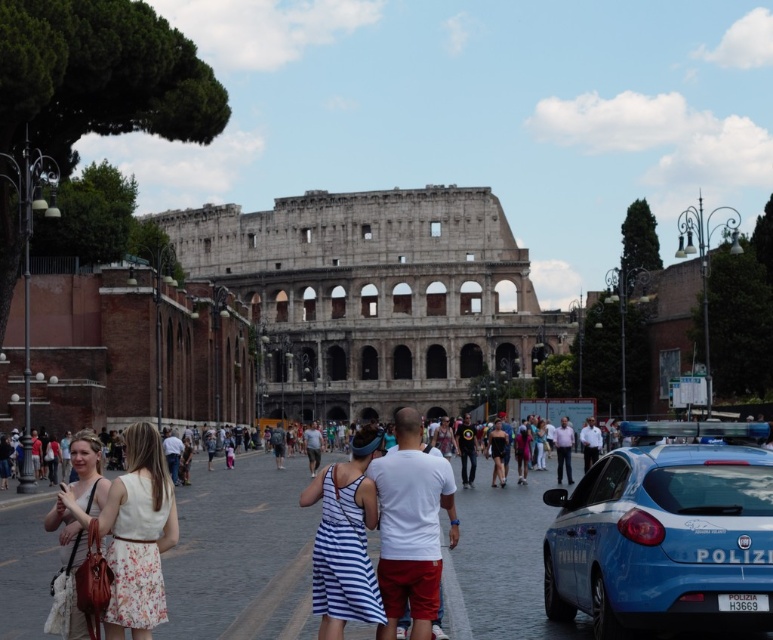
Is point (368, 426) positioned after point (89, 461)?

Yes, point (368, 426) is behind point (89, 461).

Which is more to the right, white striped dress at center or floral dress at lower left?

From the viewer's perspective, white striped dress at center appears more on the right side.

You are a GUI agent. You are given a task and a screenshot of the screen. Output one action in this format:
    pyautogui.click(x=<x>, y=<y>)
    Task: Click on the white striped dress at center
    The width and height of the screenshot is (773, 640).
    Given the screenshot: What is the action you would take?
    pyautogui.click(x=344, y=540)

At what (x,y) coordinates should I click in order to perform the action: click on white striped dress at center. Please return your answer as a coordinate pair (x, y). The height and width of the screenshot is (640, 773). Looking at the image, I should click on (344, 540).

Identify the location of white floral dress at lower left. (138, 536).

Is white floral dress at lower left further to camera compared to white cotton shirt at center?

No, white floral dress at lower left is in front of white cotton shirt at center.

I want to click on white floral dress at lower left, so click(138, 536).

Who is positioned more to the left, floral dress at lower left or dark blue fabric dress at center?

Positioned to the left is floral dress at lower left.

Who is more forward, (x=96, y=445) or (x=499, y=472)?

Point (x=96, y=445)

Is point (70, 538) less distant than point (494, 484)?

Yes, point (70, 538) is closer to viewer.

At what (x,y) coordinates should I click in order to perform the action: click on floral dress at lower left. Please return your answer as a coordinate pair (x, y). Image resolution: width=773 pixels, height=640 pixels. Looking at the image, I should click on (87, 472).